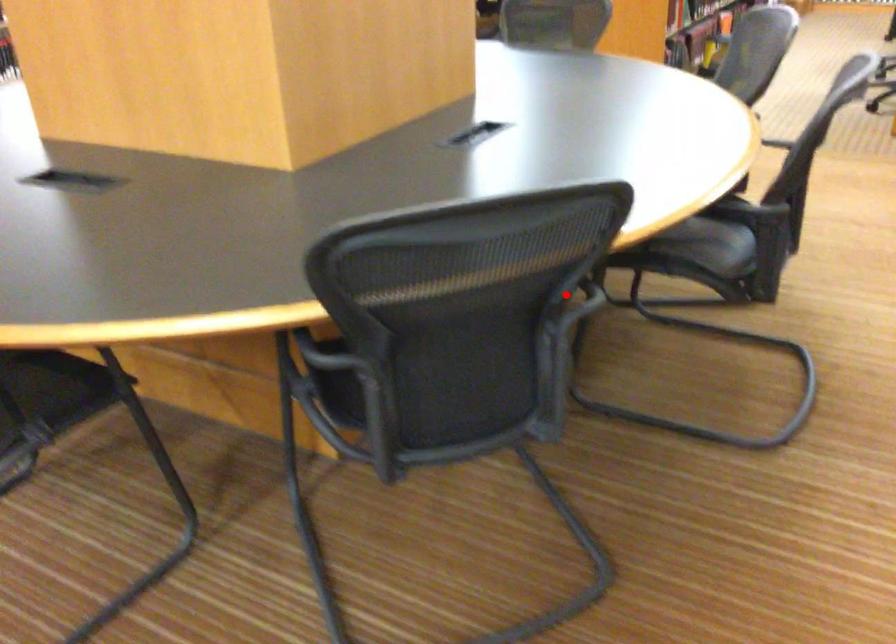
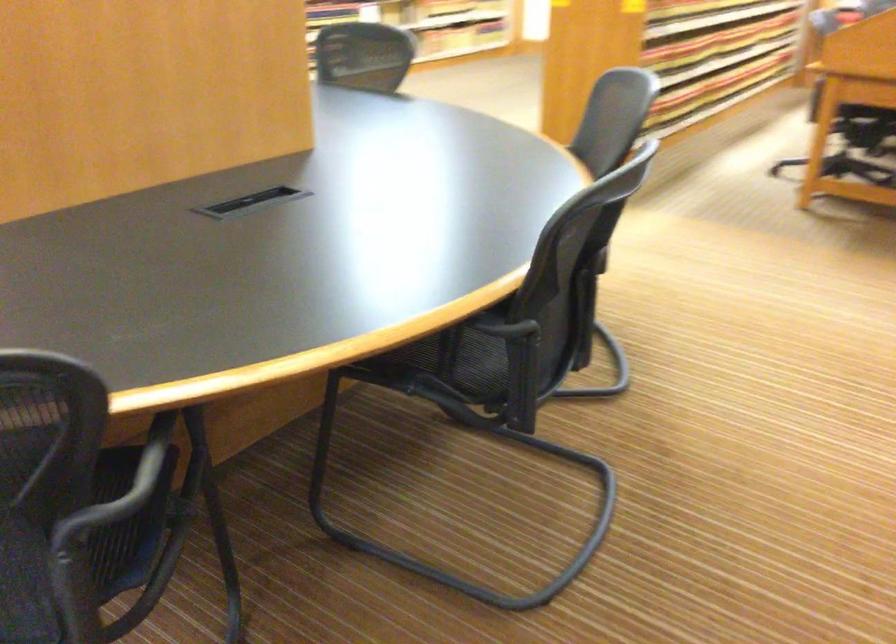
Question: I am providing you with two images of the same scene from different viewpoints. A red point is shown in image1. For the corresponding object point in image2, is it positioned nearer or farther from the camera?

Choices:
 (A) Nearer
 (B) Farther

Answer: (A)